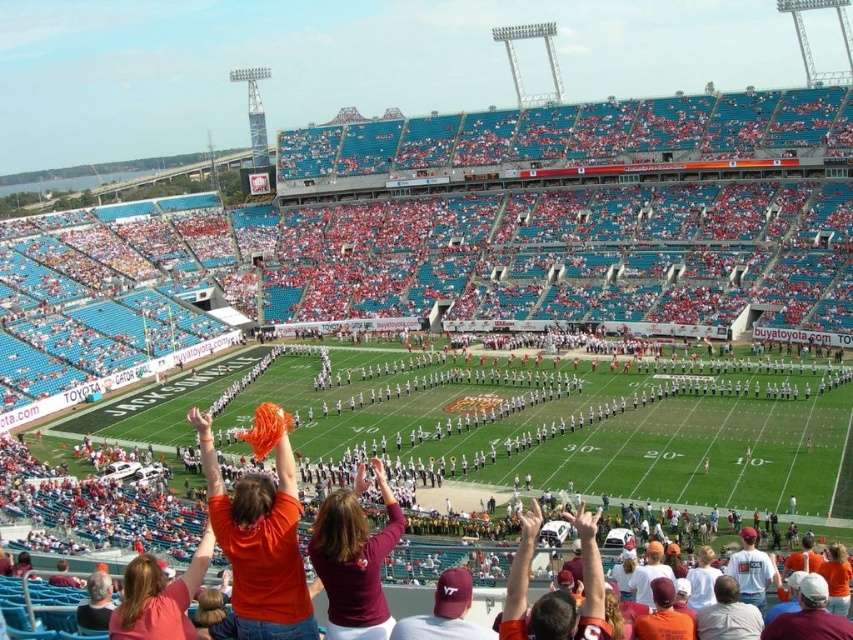
Question: Is the position of orange fabric at center less distant than that of maroon jersey at center?

Choices:
 (A) no
 (B) yes

Answer: (A)

Question: Does orange fabric at center come in front of maroon jersey at center?

Choices:
 (A) yes
 (B) no

Answer: (B)

Question: Where is orange fabric at center located in relation to maroon jersey at center in the image?

Choices:
 (A) above
 (B) below

Answer: (A)